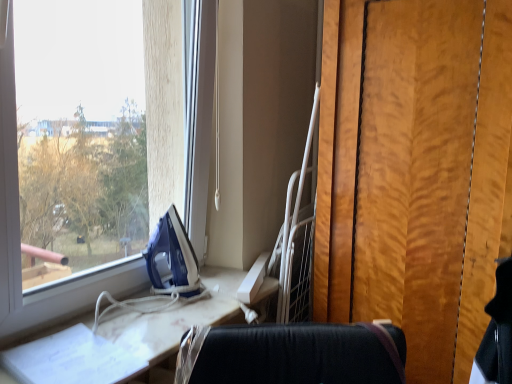
This screenshot has width=512, height=384. Describe the element at coordinates (173, 255) in the screenshot. I see `blue plastic iron at window` at that location.

Identify the location of blue plastic iron at window. Image resolution: width=512 pixels, height=384 pixels. (173, 255).

What is the approximate width of white glossy ironing board at left?

white glossy ironing board at left is 13.69 inches in width.

The image size is (512, 384). What do you see at coordinates (163, 328) in the screenshot?
I see `white glossy ironing board at left` at bounding box center [163, 328].

What are the coordinates of `white glossy ironing board at left` in the screenshot? It's located at click(x=163, y=328).

This screenshot has height=384, width=512. Find the location of `blue plastic iron at window`. blue plastic iron at window is located at coordinates (173, 255).

Based on their positions, is blue plastic iron at window located to the left or right of white glossy ironing board at left?

blue plastic iron at window is to the right of white glossy ironing board at left.

Does blue plastic iron at window come in front of white glossy ironing board at left?

No, blue plastic iron at window is further to the viewer.

Is point (167, 234) in front of point (133, 316)?

No, (167, 234) is behind (133, 316).

From the image's perspective, which one is positioned higher, blue plastic iron at window or white glossy ironing board at left?

blue plastic iron at window appears higher in the image.

From a real-world perspective, is blue plastic iron at window physically located above or below white glossy ironing board at left?

blue plastic iron at window is situated higher than white glossy ironing board at left in the real world.

Considering the relative sizes of blue plastic iron at window and white glossy ironing board at left in the image provided, is blue plastic iron at window thinner than white glossy ironing board at left?

Yes.

From their relative heights in the image, would you say blue plastic iron at window is taller or shorter than white glossy ironing board at left?

In the image, blue plastic iron at window appears to be taller than white glossy ironing board at left.

Does blue plastic iron at window have a smaller size compared to white glossy ironing board at left?

Actually, blue plastic iron at window might be larger than white glossy ironing board at left.

Is white glossy ironing board at left located within blue plastic iron at window?

No, blue plastic iron at window does not contain white glossy ironing board at left.

Does blue plastic iron at window touch white glossy ironing board at left?

blue plastic iron at window and white glossy ironing board at left are clearly separated.

Is blue plastic iron at window oriented away from white glossy ironing board at left?

blue plastic iron at window does not have its back to white glossy ironing board at left.

What's the angular difference between blue plastic iron at window and white glossy ironing board at left's facing directions?

blue plastic iron at window and white glossy ironing board at left are facing 3.02 degrees away from each other.

In the image, there is a blue plastic iron at window. Identify the location of furniture below it (from a real-world perspective). This screenshot has height=384, width=512. (163, 328).

Does white glossy ironing board at left appear on the right side of blue plastic iron at window?

Incorrect, white glossy ironing board at left is not on the right side of blue plastic iron at window.

Considering the relative positions of white glossy ironing board at left and blue plastic iron at window in the image provided, is white glossy ironing board at left in front of blue plastic iron at window?

Yes, white glossy ironing board at left is closer to the camera.

Which point is more distant from viewer, (x=214, y=278) or (x=167, y=259)?

The point (x=214, y=278) is behind.

From the image's perspective, who appears lower, white glossy ironing board at left or blue plastic iron at window?

white glossy ironing board at left appears lower in the image.

From a real-world perspective, which is physically above, white glossy ironing board at left or blue plastic iron at window?

From a 3D spatial view, blue plastic iron at window is above.

Considering the sizes of objects white glossy ironing board at left and blue plastic iron at window in the image provided, who is thinner, white glossy ironing board at left or blue plastic iron at window?

With smaller width is blue plastic iron at window.

From their relative heights in the image, would you say white glossy ironing board at left is taller or shorter than blue plastic iron at window?

Considering their sizes, white glossy ironing board at left has less height than blue plastic iron at window.

Between white glossy ironing board at left and blue plastic iron at window, which one has larger size?

Bigger between the two is blue plastic iron at window.

Is white glossy ironing board at left located outside blue plastic iron at window?

Absolutely, white glossy ironing board at left is external to blue plastic iron at window.

From the picture: Is there a large distance between white glossy ironing board at left and blue plastic iron at window?

No, white glossy ironing board at left is not far from blue plastic iron at window.

Is blue plastic iron at window at the back of white glossy ironing board at left?

white glossy ironing board at left is not turned away from blue plastic iron at window.

Locate an element on the screen. The image size is (512, 384). furniture on the left of blue plastic iron at window is located at coordinates (163, 328).

At what (x,y) coordinates should I click in order to perform the action: click on equipment above the white glossy ironing board at left (from the image's perspective). Please return your answer as a coordinate pair (x, y). Image resolution: width=512 pixels, height=384 pixels. Looking at the image, I should click on (173, 255).

Find the location of a particular element. This screenshot has width=512, height=384. furniture located on the left of blue plastic iron at window is located at coordinates [x=163, y=328].